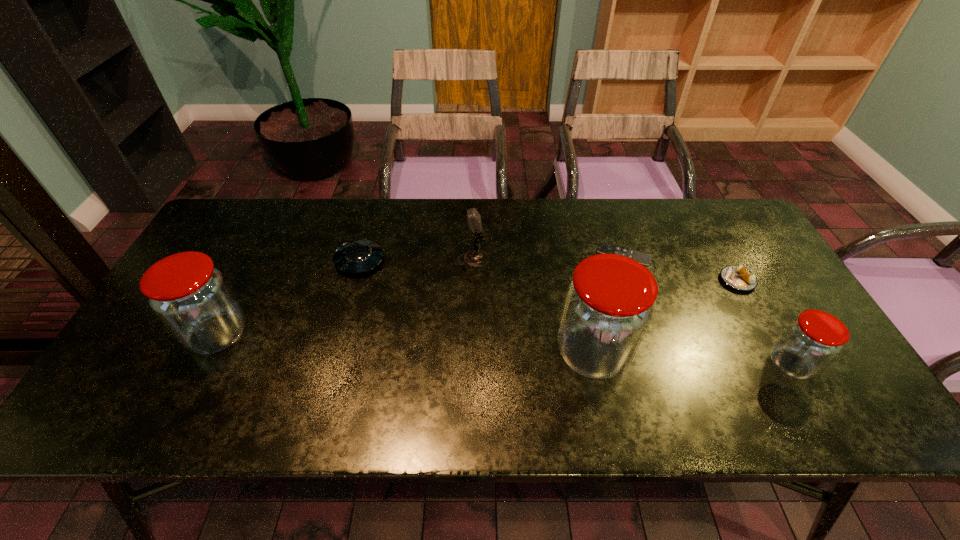
This screenshot has width=960, height=540. I want to click on jar at the right edge, so click(x=811, y=341).

Where is `pastry that is at the right edge`? The width and height of the screenshot is (960, 540). pastry that is at the right edge is located at coordinates (737, 277).

You are a GUI agent. You are given a task and a screenshot of the screen. Output one action in this format:
    pyautogui.click(x=<x>, y=<y>)
    Task: Click on the object that is at the near left corner
    The image size is (960, 540).
    Given the screenshot: What is the action you would take?
    pyautogui.click(x=191, y=297)

Where is `object at the near right corner`? This screenshot has height=540, width=960. object at the near right corner is located at coordinates (811, 341).

Where is `vacant space at the far edge of the desktop`? The width and height of the screenshot is (960, 540). vacant space at the far edge of the desktop is located at coordinates (648, 240).

Image resolution: width=960 pixels, height=540 pixels. I want to click on vacant space at the near edge of the desktop, so coord(475,364).

This screenshot has height=540, width=960. In order to click on vacant space at the near left corner of the desktop in this screenshot , I will do `click(132, 362)`.

Where is `free region at the far right corner of the desktop`? The width and height of the screenshot is (960, 540). free region at the far right corner of the desktop is located at coordinates (709, 209).

The width and height of the screenshot is (960, 540). I want to click on free spot between the rightmost jar and the second jar from left to right, so click(692, 359).

The height and width of the screenshot is (540, 960). What are the coordinates of `free spot between the second jar from left to right and the shortest jar` in the screenshot? It's located at (692, 359).